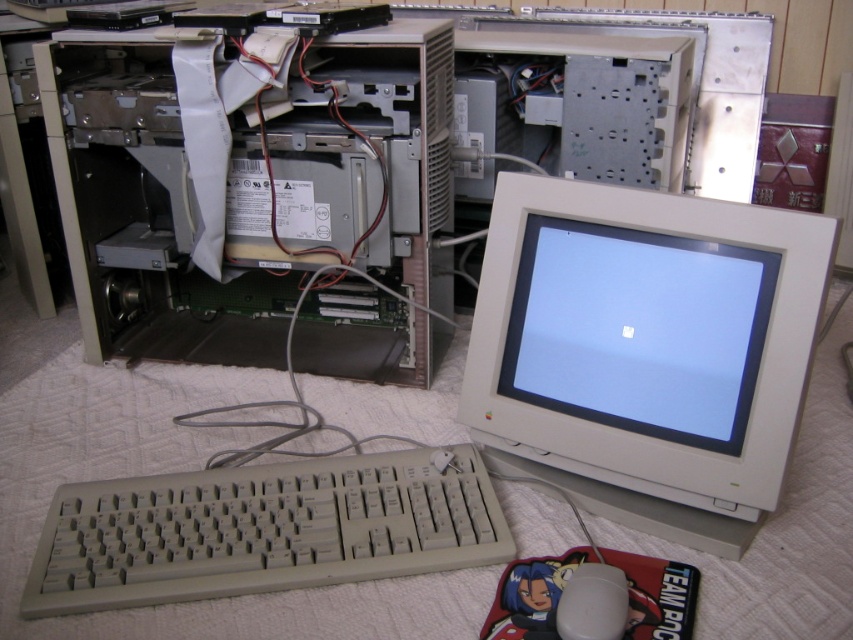
Who is more forward, [753,512] or [573,632]?

Point [573,632] is more forward.

Does white plastic monitor at center appear over white matte mouse at lower center?

A: Indeed, white plastic monitor at center is positioned over white matte mouse at lower center.

Find the location of a particular element. white plastic monitor at center is located at coordinates (645, 349).

From the picture: Who is shorter, silver metallic computer at center or white matte mouse at lower center?

white matte mouse at lower center is shorter.

Is point (392, 220) behind point (605, 584)?

Yes.

Between point (80, 86) and point (618, 602), which one is positioned in front?

Positioned in front is point (618, 602).

Find the location of a particular element. Image resolution: width=853 pixels, height=640 pixels. silver metallic computer at center is located at coordinates coord(245,186).

Measure the distance between white glossy monitor at center and white matte mouse at lower center.

A distance of 9.52 inches exists between white glossy monitor at center and white matte mouse at lower center.

Is white glossy monitor at center to the right of white matte mouse at lower center from the viewer's perspective?

Yes, white glossy monitor at center is to the right of white matte mouse at lower center.

This screenshot has width=853, height=640. Find the location of `white glossy monitor at center`. white glossy monitor at center is located at coordinates (637, 330).